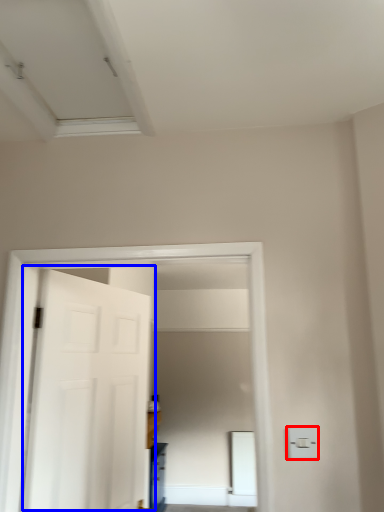
Question: Which of the following is the farthest to the observer, light switch (highlighted by a red box) or door (highlighted by a blue box)?

Choices:
 (A) light switch
 (B) door

Answer: (B)